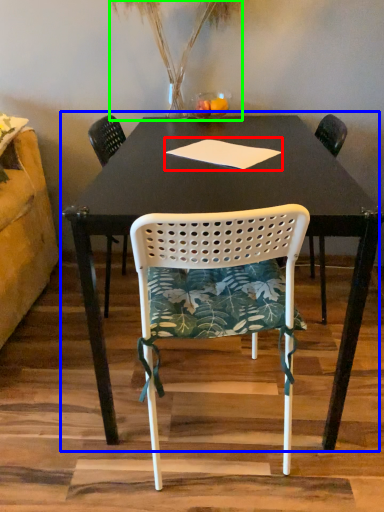
Question: Based on their relative distances, which object is nearer to notepad (highlighted by a red box)? Choose from table (highlighted by a blue box) and plant (highlighted by a green box).

Choices:
 (A) table
 (B) plant

Answer: (A)